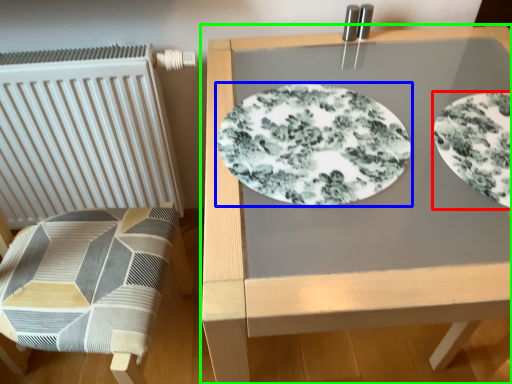
Question: Estimate the real-world distances between objects in this image. Which object is closer to plate (highlighted by a red box), plate (highlighted by a blue box) or table (highlighted by a green box)?

Choices:
 (A) plate
 (B) table

Answer: (A)